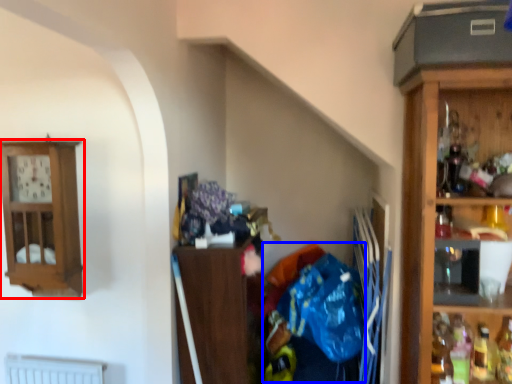
Question: Among these objects, which one is nearest to the camera, cabinetry (highlighted by a red box) or waste (highlighted by a blue box)?

Choices:
 (A) cabinetry
 (B) waste

Answer: (B)